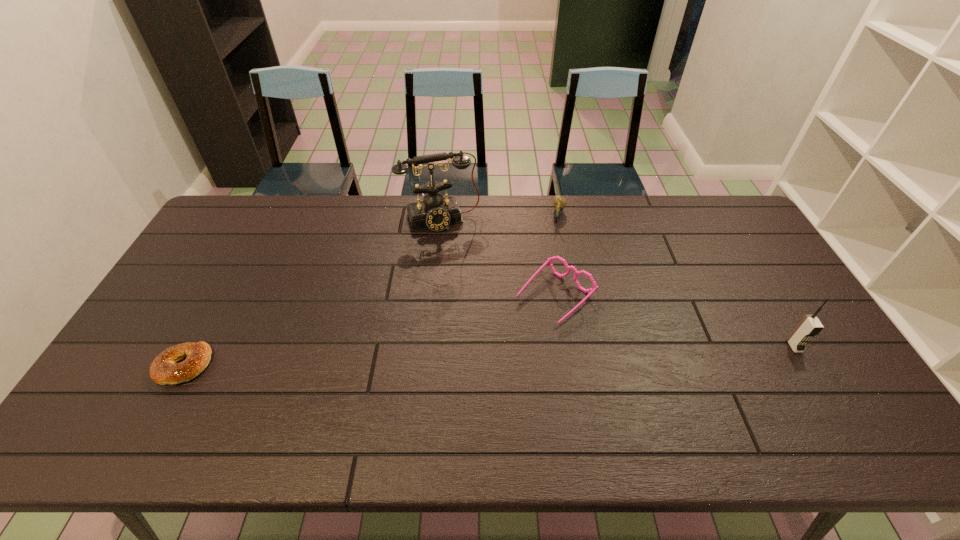
Find the location of a particular element. vacant space situated 0.180m on the arms of the spectacles is located at coordinates (489, 359).

Where is `vacant area situated on the arms of the spectacles`? vacant area situated on the arms of the spectacles is located at coordinates (478, 368).

Locate an element on the screen. Image resolution: width=960 pixels, height=540 pixels. free space located on the arms of the spectacles is located at coordinates (506, 342).

Find the location of `vacant space located 0.210m on the dial of the second object from left to right`. vacant space located 0.210m on the dial of the second object from left to right is located at coordinates (466, 275).

This screenshot has width=960, height=540. Find the location of `vacant space located 0.110m on the dial of the second object from left to right`. vacant space located 0.110m on the dial of the second object from left to right is located at coordinates (458, 254).

Image resolution: width=960 pixels, height=540 pixels. I want to click on free spot located 0.210m on the dial of the second object from left to right, so 466,275.

Where is `vacant area situated on the front-facing side of the escargot`? The width and height of the screenshot is (960, 540). vacant area situated on the front-facing side of the escargot is located at coordinates [554, 248].

The height and width of the screenshot is (540, 960). Identify the location of vacant area situated 0.250m on the front-facing side of the escargot. (547, 275).

You are a GUI agent. You are given a task and a screenshot of the screen. Output one action in this format:
    pyautogui.click(x=<x>, y=<y>)
    Task: Click on the vacant area located on the front-facing side of the escargot
    
    Given the screenshot: What is the action you would take?
    pyautogui.click(x=553, y=249)

Locate an element on the screen. telephone at the far edge is located at coordinates (436, 213).